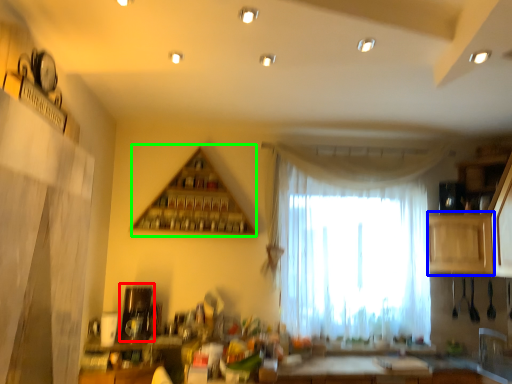
Question: Which object is the closest to the appliance (highlighted by a red box)? Choose among these: cabinetry (highlighted by a blue box) or shelf (highlighted by a green box).

Choices:
 (A) cabinetry
 (B) shelf

Answer: (B)